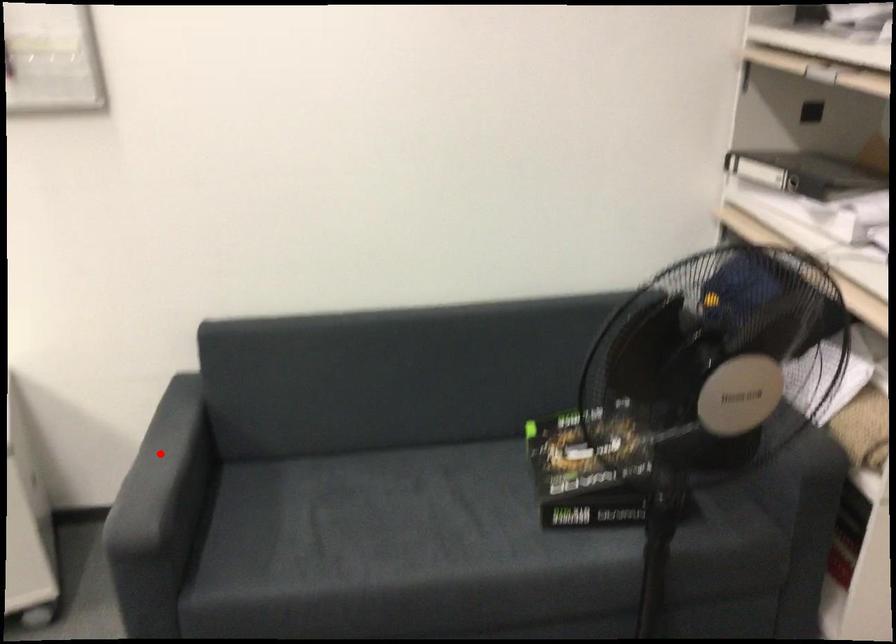
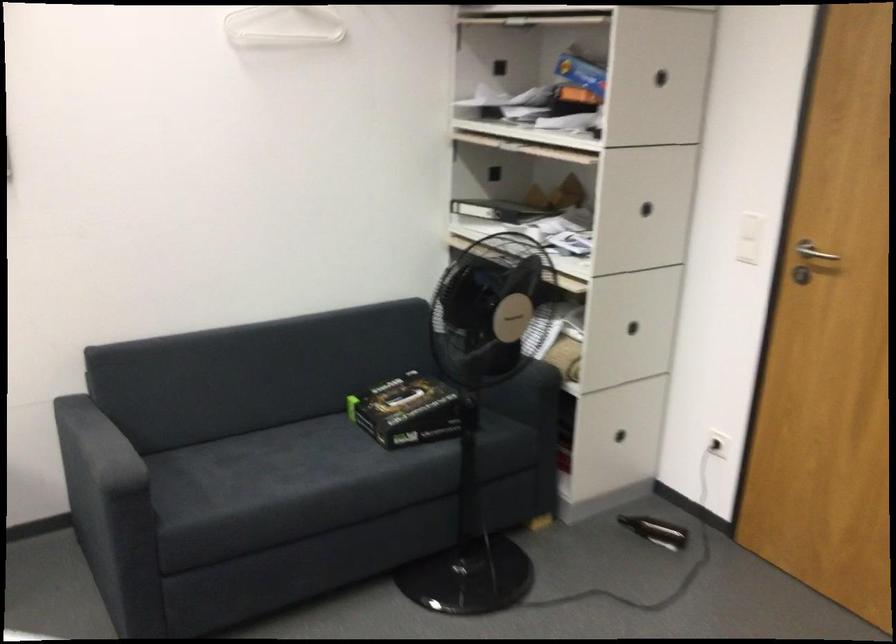
Where in the second image is the point corresponding to the highlighted location from the first image?

(93, 440)